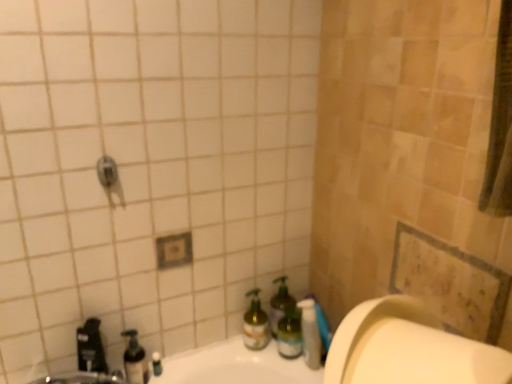
Question: Would you consider translucent plastic soap dispenser at lower left to be distant from green glass bottle at lower center, which is the second bottle in right-to-left order?

Choices:
 (A) no
 (B) yes

Answer: (A)

Question: Is the position of translucent plastic soap dispenser at lower left more distant than that of green glass bottle at lower center, which is the second bottle in right-to-left order?

Choices:
 (A) no
 (B) yes

Answer: (A)

Question: From the image's perspective, is translucent plastic soap dispenser at lower left located beneath green glass bottle at lower center, which is the second bottle in right-to-left order?

Choices:
 (A) yes
 (B) no

Answer: (A)

Question: Can you see translucent plastic soap dispenser at lower left touching green glass bottle at lower center, which is the second bottle in right-to-left order?

Choices:
 (A) no
 (B) yes

Answer: (A)

Question: Considering the relative sizes of translucent plastic soap dispenser at lower left and green glass bottle at lower center, which is the second bottle in right-to-left order, in the image provided, is translucent plastic soap dispenser at lower left taller than green glass bottle at lower center, which is the second bottle in right-to-left order,?

Choices:
 (A) no
 (B) yes

Answer: (A)

Question: Based on their sizes in the image, would you say green glass bottle at lower right, the first bottle from the right, is bigger or smaller than translucent plastic pump bottle at lower center?

Choices:
 (A) big
 (B) small

Answer: (B)

Question: Considering the positions of point (293, 327) and point (304, 339), is point (293, 327) closer or farther from the camera than point (304, 339)?

Choices:
 (A) closer
 (B) farther

Answer: (B)

Question: From the image's perspective, relative to translucent plastic pump bottle at lower center, is green glass bottle at lower right, the first bottle from the right, above or below?

Choices:
 (A) below
 (B) above

Answer: (B)

Question: Visually, is green glass bottle at lower right, the first bottle from the right, positioned to the left or to the right of translucent plastic pump bottle at lower center?

Choices:
 (A) left
 (B) right

Answer: (A)

Question: Would you say green glass bottle at lower center, which is the 3th bottle in left-to-right order, is inside or outside translucent plastic soap dispenser at lower left, the first bottle in the left-to-right sequence?

Choices:
 (A) inside
 (B) outside

Answer: (B)

Question: From a real-world perspective, is green glass bottle at lower center, which is the 3th bottle in left-to-right order, positioned above or below translucent plastic soap dispenser at lower left, positioned as the 4th bottle in right-to-left order?

Choices:
 (A) below
 (B) above

Answer: (B)

Question: Is point (272, 304) closer or farther from the camera than point (134, 382)?

Choices:
 (A) closer
 (B) farther

Answer: (B)

Question: Is green glass bottle at lower center, which is the second bottle in right-to-left order, taller or shorter than translucent plastic soap dispenser at lower left, positioned as the 4th bottle in right-to-left order?

Choices:
 (A) short
 (B) tall

Answer: (B)

Question: Looking at their shapes, would you say green glass spray bottle at lower center, the second bottle positioned from the left, is wider or thinner than green glass bottle at lower right, the first bottle from the right?

Choices:
 (A) wide
 (B) thin

Answer: (A)

Question: Do you think green glass spray bottle at lower center, the second bottle positioned from the left, is within green glass bottle at lower right, placed as the fourth bottle when sorted from left to right, or outside of it?

Choices:
 (A) inside
 (B) outside

Answer: (B)